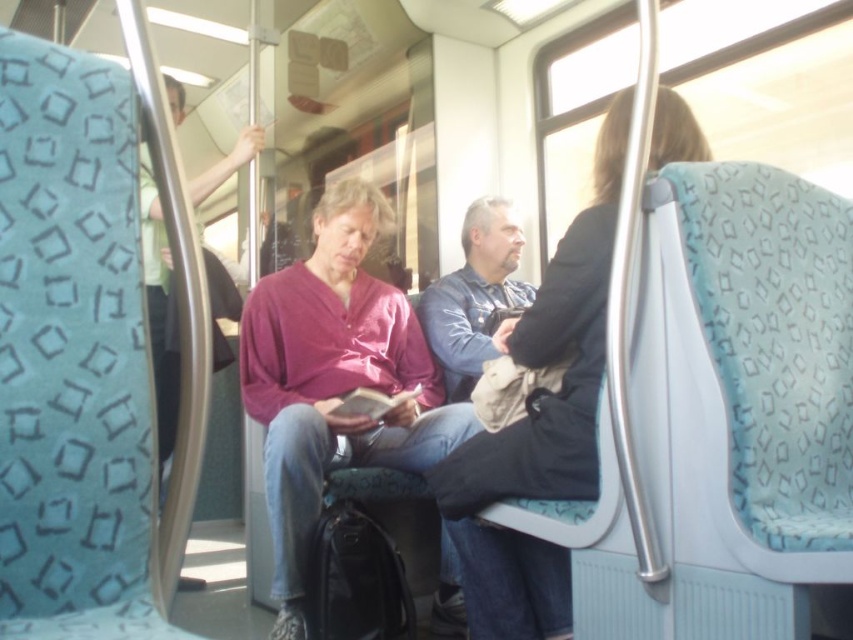
Can you confirm if matte purple sweater at center is positioned to the right of blue denim jacket at center?

No, matte purple sweater at center is not to the right of blue denim jacket at center.

Describe the element at coordinates (335, 380) in the screenshot. Image resolution: width=853 pixels, height=640 pixels. I see `matte purple sweater at center` at that location.

You are a GUI agent. You are given a task and a screenshot of the screen. Output one action in this format:
    pyautogui.click(x=<x>, y=<y>)
    Task: Click on the matte purple sweater at center
    The image size is (853, 640).
    Given the screenshot: What is the action you would take?
    pyautogui.click(x=335, y=380)

Who is more forward, (395,324) or (524,356)?

Positioned in front is point (524,356).

Does matte purple sweater at center come in front of black fabric jacket at center?

No, it is not.

The width and height of the screenshot is (853, 640). I want to click on matte purple sweater at center, so click(335, 380).

Does black fabric jacket at center come in front of blue denim jacket at center?

Yes, black fabric jacket at center is in front of blue denim jacket at center.

Is point (583, 364) positioned in front of point (490, 208)?

Yes.

Find the location of `black fabric jacket at center`. black fabric jacket at center is located at coordinates (540, 424).